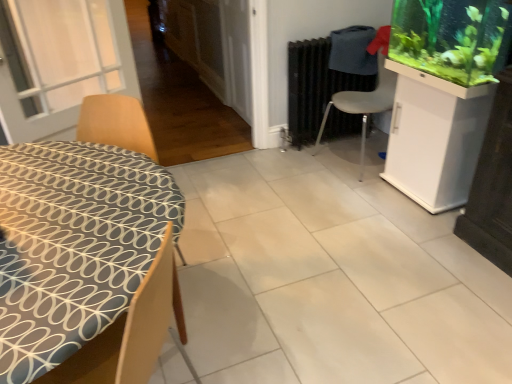
Locate an element on the screen. This screenshot has height=384, width=512. vacant space that's between white plastic chair at center-right, the 2th chair viewed from the front, and black matte radiator at center is located at coordinates (328, 155).